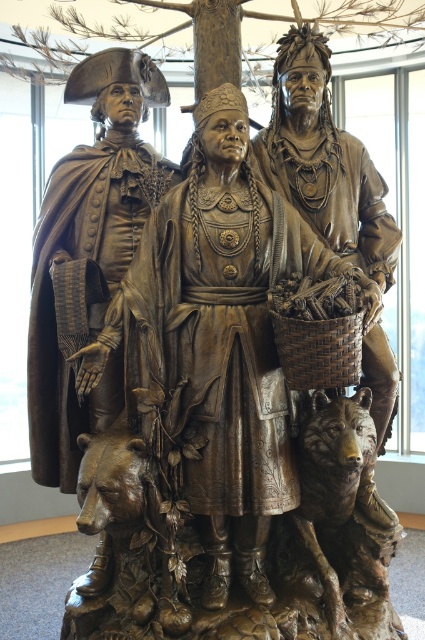
Which is behind, point (277, 202) or point (399, 6)?

The point (399, 6) is more distant.

Based on the photo, is bronze statue at center closer to camera compared to bronze textured tree trunk at center?

Yes, bronze statue at center is closer to the viewer.

Locate an element on the screen. The image size is (425, 640). bronze statue at center is located at coordinates (217, 346).